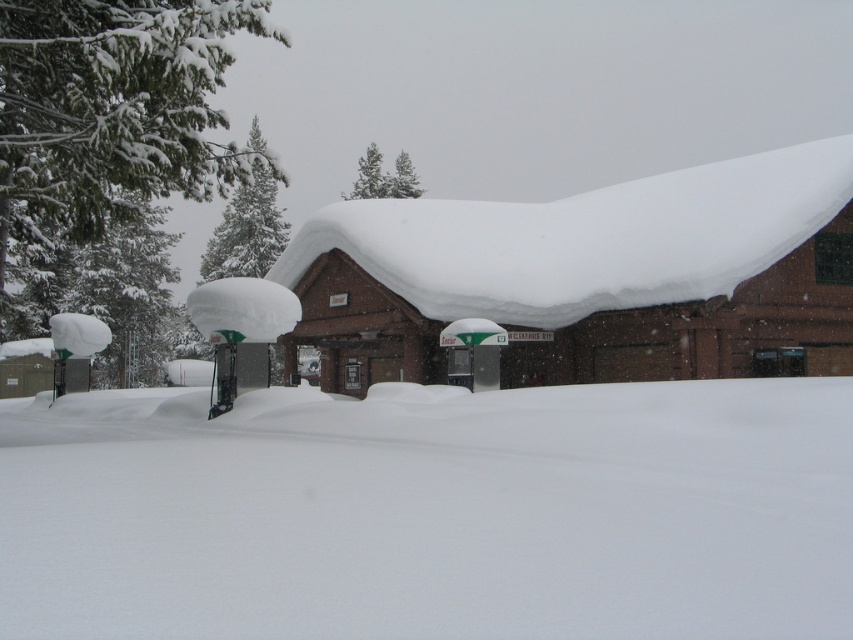
Question: Which point is closer to the camera?

Choices:
 (A) (804, 538)
 (B) (35, 136)
 (C) (369, 150)
 (D) (270, 188)

Answer: (A)

Question: Is green textured snow at left in front of snow-covered pine trees at upper center?

Choices:
 (A) yes
 (B) no

Answer: (A)

Question: Is white fluffy snow at lower center thinner than green textured snow at left?

Choices:
 (A) yes
 (B) no

Answer: (A)

Question: Estimate the real-world distances between objects in this image. Which object is farther from the brown brick cabin at center?

Choices:
 (A) green textured snow at left
 (B) snow-covered pine trees at upper center
 (C) white fluffy snow at lower center

Answer: (B)

Question: Which point is closer to the camera taking this photo?

Choices:
 (A) (579, 316)
 (B) (15, 45)

Answer: (B)

Question: Is brown brick cabin at center bigger than green textured snow at left?

Choices:
 (A) yes
 (B) no

Answer: (B)